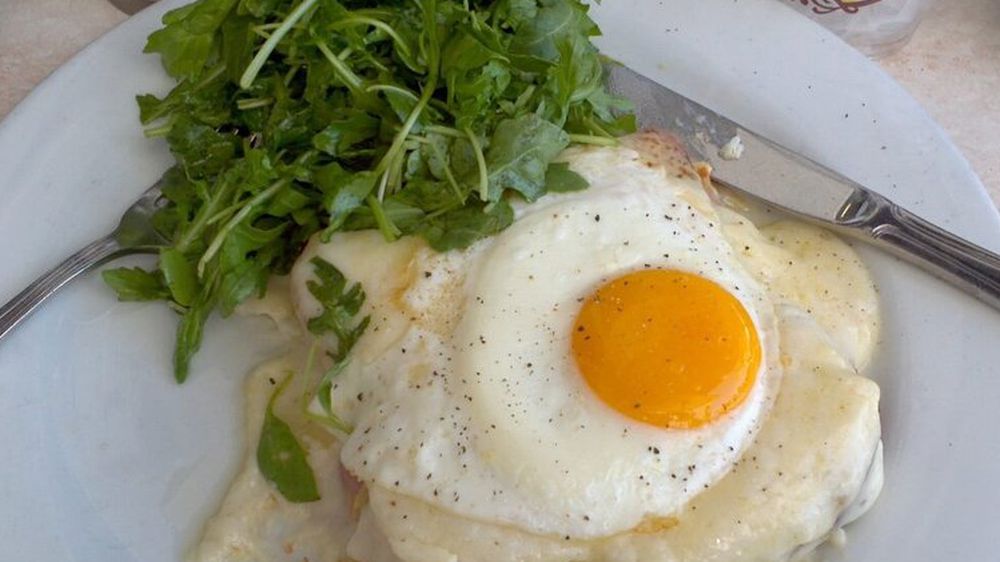
Locate an element on the screen. Image resolution: width=1000 pixels, height=562 pixels. white plate is located at coordinates (78, 443).